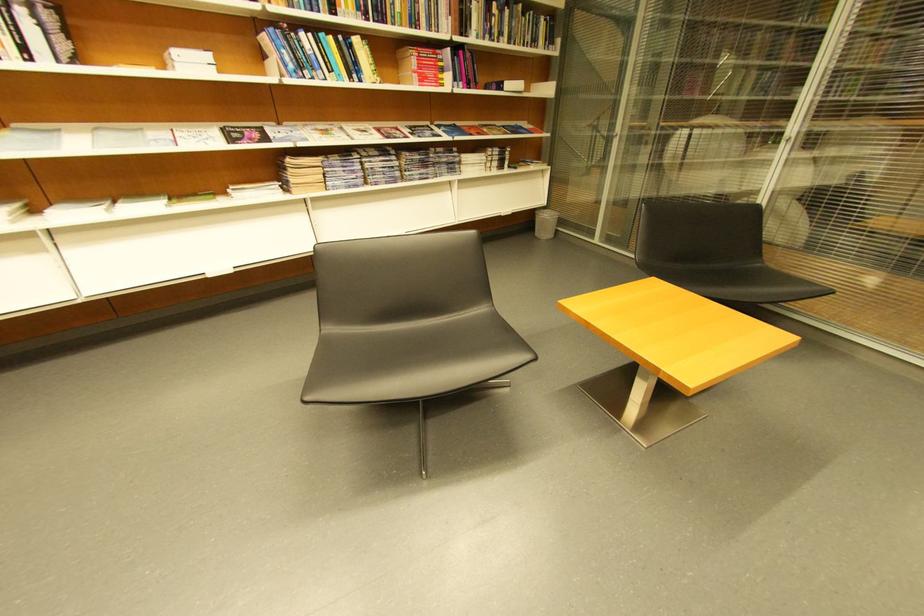
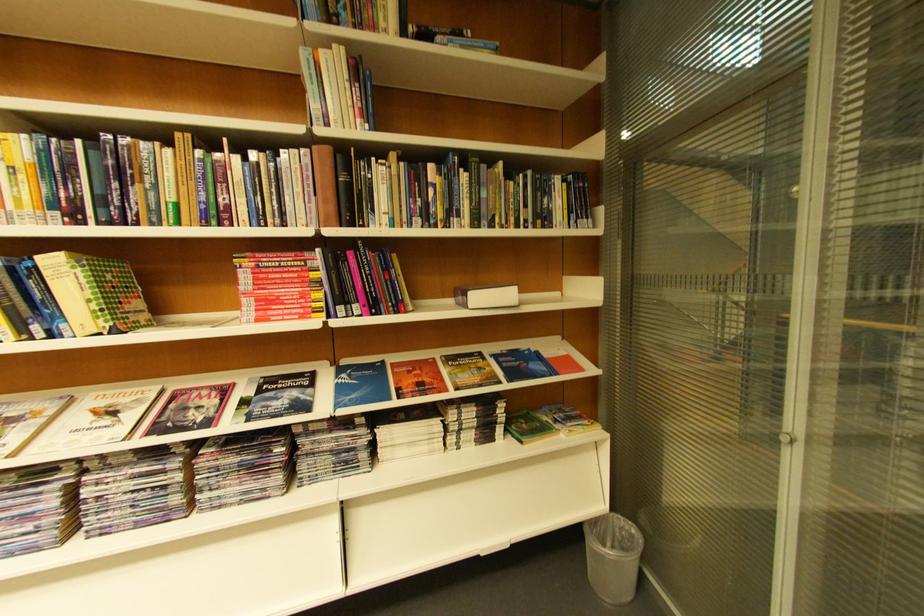
Find the pixel in the second image that matches point 434,55 in the first image.

(281, 262)